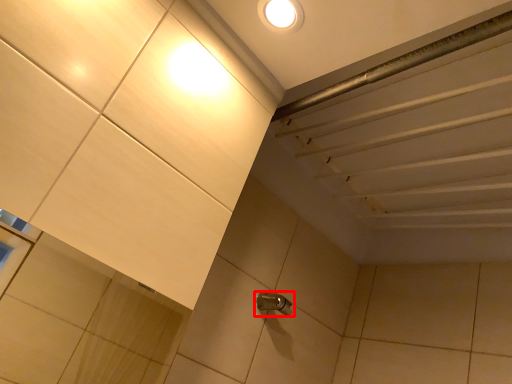
Question: Considering the relative positions of plumbing fixture (annotated by the red box) and droplight in the image provided, where is plumbing fixture (annotated by the red box) located with respect to the staircase?

Choices:
 (A) right
 (B) left

Answer: (A)